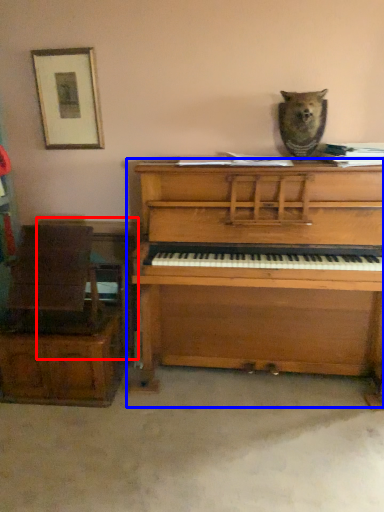
Question: Among these objects, which one is nearest to the camera, table (highlighted by a red box) or piano (highlighted by a blue box)?

Choices:
 (A) table
 (B) piano

Answer: (B)